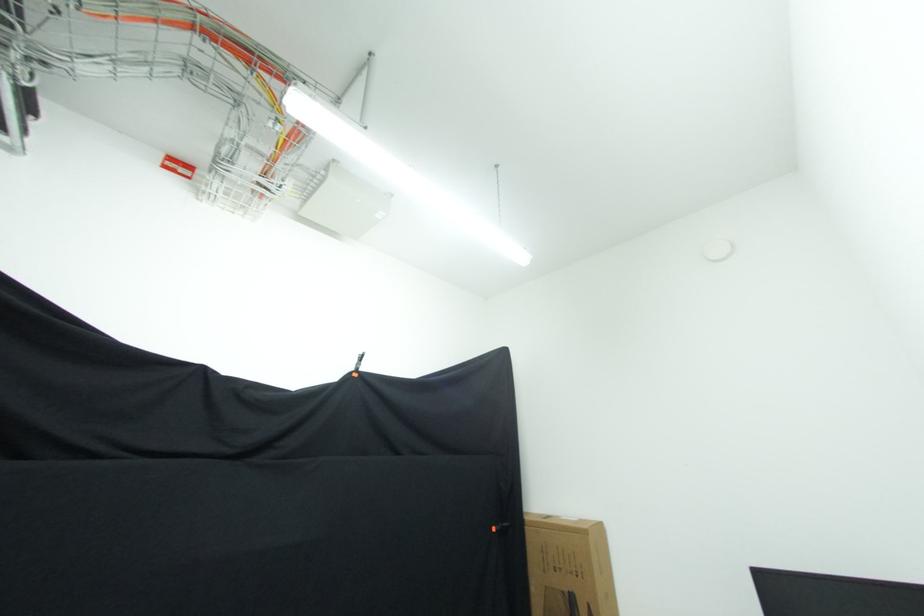
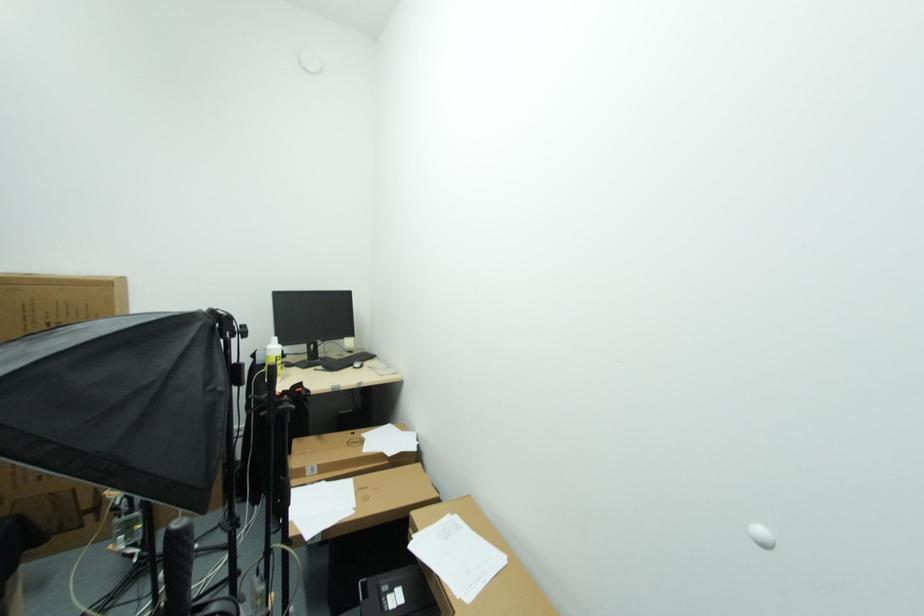
Find the pixel in the second image that matches (560,572) in the first image.

(53, 328)